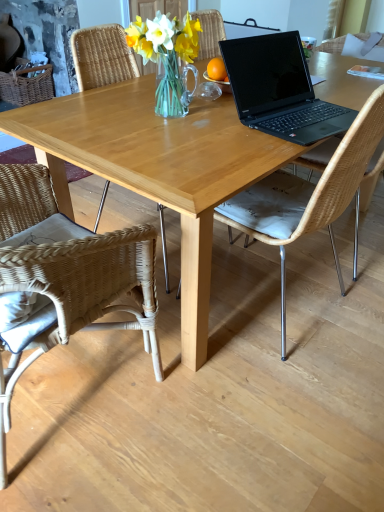
Question: From a real-world perspective, is natural wicker chair at center, the second chair viewed from the left, on light wood table at center?

Choices:
 (A) yes
 (B) no

Answer: (A)

Question: Can you confirm if natural wicker chair at center, the second chair viewed from the left, is shorter than light wood table at center?

Choices:
 (A) yes
 (B) no

Answer: (B)

Question: Is natural wicker chair at center, which is the 1th chair in right-to-left order, completely or partially outside of light wood table at center?

Choices:
 (A) no
 (B) yes

Answer: (A)

Question: Is natural wicker chair at center, the second chair viewed from the left, with light wood table at center?

Choices:
 (A) no
 (B) yes

Answer: (A)

Question: Does natural wicker chair at center, the second chair viewed from the left, come in front of light wood table at center?

Choices:
 (A) yes
 (B) no

Answer: (A)

Question: Considering the positions of clear glass vase at center and light wood table at center in the image, is clear glass vase at center wider or thinner than light wood table at center?

Choices:
 (A) wide
 (B) thin

Answer: (B)

Question: From a real-world perspective, is clear glass vase at center physically located above or below light wood table at center?

Choices:
 (A) above
 (B) below

Answer: (A)

Question: Does point (188, 95) appear closer or farther from the camera than point (145, 181)?

Choices:
 (A) farther
 (B) closer

Answer: (A)

Question: Considering the positions of clear glass vase at center and light wood table at center in the image, is clear glass vase at center taller or shorter than light wood table at center?

Choices:
 (A) tall
 (B) short

Answer: (B)

Question: Based on their positions, is woven rattan chair at lower left, acting as the first chair starting from the left, located to the left or right of clear glass vase at center?

Choices:
 (A) right
 (B) left

Answer: (B)

Question: From the image's perspective, is woven rattan chair at lower left, positioned as the second chair in right-to-left order, above or below clear glass vase at center?

Choices:
 (A) above
 (B) below

Answer: (B)

Question: Is point [1, 288] positioned closer to the camera than point [175, 44]?

Choices:
 (A) farther
 (B) closer

Answer: (B)

Question: Is woven rattan chair at lower left, positioned as the second chair in right-to-left order, bigger or smaller than clear glass vase at center?

Choices:
 (A) big
 (B) small

Answer: (A)

Question: From the image's perspective, relative to woven rattan chair at lower left, acting as the first chair starting from the left, is natural wicker chair at center, the second chair viewed from the left, above or below?

Choices:
 (A) below
 (B) above

Answer: (B)

Question: From a real-world perspective, is natural wicker chair at center, which is the 1th chair in right-to-left order, physically located above or below woven rattan chair at lower left, acting as the first chair starting from the left?

Choices:
 (A) below
 (B) above

Answer: (B)